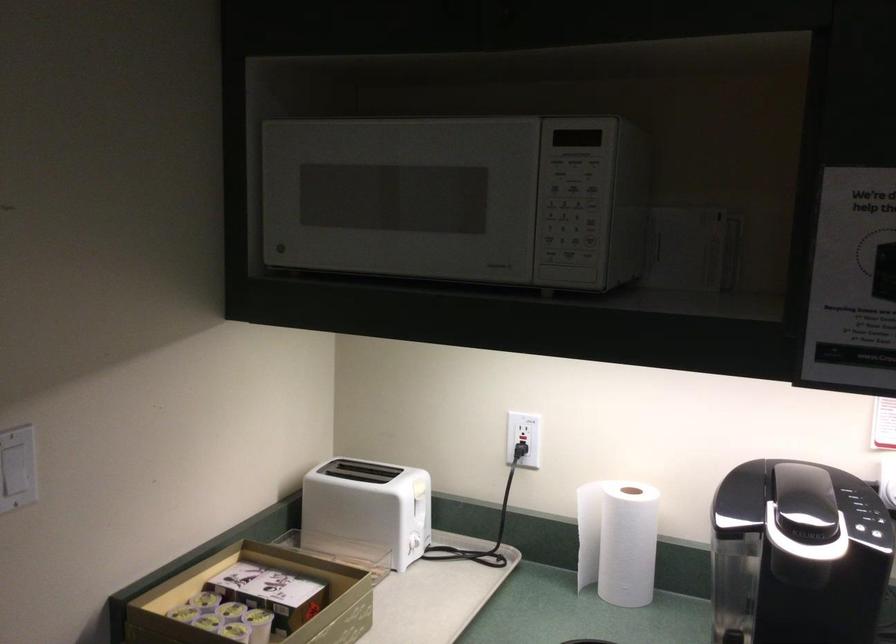
Identify the location of white toaster lever. This screenshot has height=644, width=896. (408, 542).